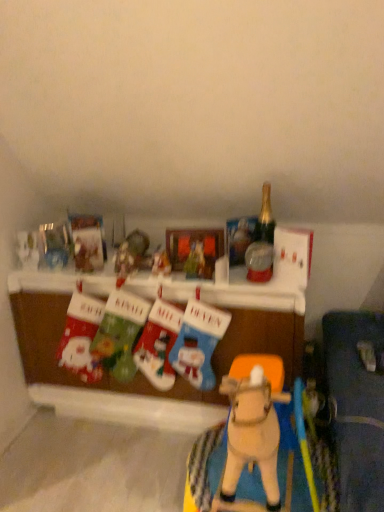
Question: From the image's perspective, is wooden horse at center, placed as the first toy when sorted from right to left, on top of matte plastic ornament at center, acting as the third toy starting from the right?

Choices:
 (A) no
 (B) yes

Answer: (A)

Question: Is wooden horse at center, placed as the first toy when sorted from right to left, aimed at matte plastic ornament at center, arranged as the 4th toy when viewed from the left?

Choices:
 (A) yes
 (B) no

Answer: (B)

Question: Can you confirm if wooden horse at center, placed as the first toy when sorted from right to left, is positioned to the left of matte plastic ornament at center, acting as the third toy starting from the right?

Choices:
 (A) no
 (B) yes

Answer: (A)

Question: Are wooden horse at center, placed as the first toy when sorted from right to left, and matte plastic ornament at center, arranged as the 4th toy when viewed from the left, located far from each other?

Choices:
 (A) yes
 (B) no

Answer: (B)

Question: Considering the relative sizes of wooden horse at center, the 6th toy from the left, and matte plastic ornament at center, acting as the third toy starting from the right, in the image provided, is wooden horse at center, the 6th toy from the left, thinner than matte plastic ornament at center, acting as the third toy starting from the right,?

Choices:
 (A) yes
 (B) no

Answer: (B)

Question: Considering the positions of point coord(279,480) and point coord(135,376), is point coord(279,480) closer or farther from the camera than point coord(135,376)?

Choices:
 (A) farther
 (B) closer

Answer: (B)

Question: Visually, is wooden horse at center, the 6th toy from the left, positioned to the left or to the right of fabric christmas stockings at center?

Choices:
 (A) left
 (B) right

Answer: (B)

Question: In terms of height, does wooden horse at center, placed as the first toy when sorted from right to left, look taller or shorter compared to fabric christmas stockings at center?

Choices:
 (A) short
 (B) tall

Answer: (A)

Question: Considering their positions, is wooden horse at center, placed as the first toy when sorted from right to left, located in front of or behind fabric christmas stockings at center?

Choices:
 (A) behind
 (B) front

Answer: (B)

Question: Is velvet christmas stockings at center, which appears as the third toy when viewed from the left, spatially inside knitted wool stocking at center, marked as the 2th toy in a right-to-left arrangement, or outside of it?

Choices:
 (A) outside
 (B) inside

Answer: (A)

Question: From their relative heights in the image, would you say velvet christmas stockings at center, which appears as the third toy when viewed from the left, is taller or shorter than knitted wool stocking at center, which ranks as the fifth toy in left-to-right order?

Choices:
 (A) tall
 (B) short

Answer: (A)

Question: In the image, is velvet christmas stockings at center, which is the 4th toy in right-to-left order, on the left side or the right side of knitted wool stocking at center, marked as the 2th toy in a right-to-left arrangement?

Choices:
 (A) left
 (B) right

Answer: (A)

Question: Is velvet christmas stockings at center, which appears as the third toy when viewed from the left, in front of or behind knitted wool stocking at center, marked as the 2th toy in a right-to-left arrangement, in the image?

Choices:
 (A) front
 (B) behind

Answer: (B)

Question: In terms of height, does matte fabric stocking at lower left, the 1th toy when ordered from left to right, look taller or shorter compared to wooden horse at center, placed as the first toy when sorted from right to left?

Choices:
 (A) tall
 (B) short

Answer: (A)

Question: Relative to wooden horse at center, the 6th toy from the left, is matte fabric stocking at lower left, the 1th toy when ordered from left to right, in front or behind?

Choices:
 (A) front
 (B) behind

Answer: (B)